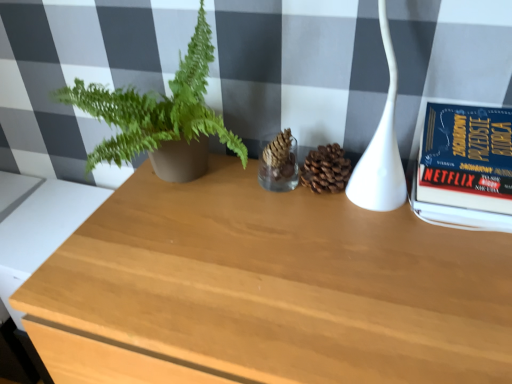
Identify the location of vacant space situated above light wood table at lower left, acting as the 1th table starting from the left (from a real-world perspective). (50, 206).